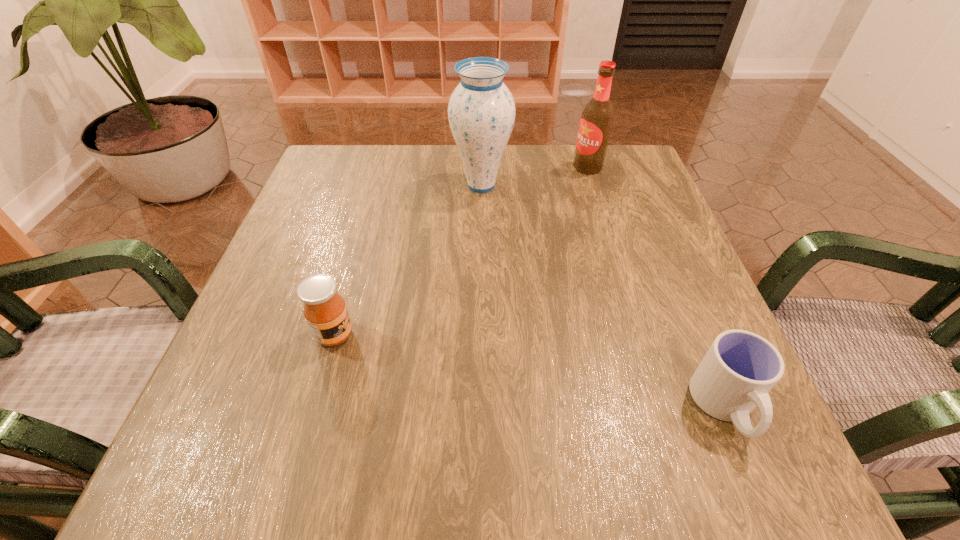
Locate an element on the screen. This screenshot has width=960, height=540. blank region between the honey and the vase is located at coordinates (408, 260).

At what (x,y) coordinates should I click in order to perform the action: click on free space between the leftmost object and the vase. Please return your answer as a coordinate pair (x, y). The height and width of the screenshot is (540, 960). Looking at the image, I should click on (408, 260).

You are a GUI agent. You are given a task and a screenshot of the screen. Output one action in this format:
    pyautogui.click(x=<x>, y=<y>)
    Task: Click on the free space between the honey and the beer bottle
    This screenshot has height=540, width=960.
    Given the screenshot: What is the action you would take?
    pyautogui.click(x=461, y=251)

Locate which object is the closest to the vase. Please provide its 2D coordinates. Your answer should be formatted as a tuple, i.e. [(x, y)], where the tuple contains the x and y coordinates of a point satisfying the conditions above.

[(597, 117)]

Identify which object is the second nearest to the nearest object. Please provide its 2D coordinates. Your answer should be formatted as a tuple, i.e. [(x, y)], where the tuple contains the x and y coordinates of a point satisfying the conditions above.

[(325, 311)]